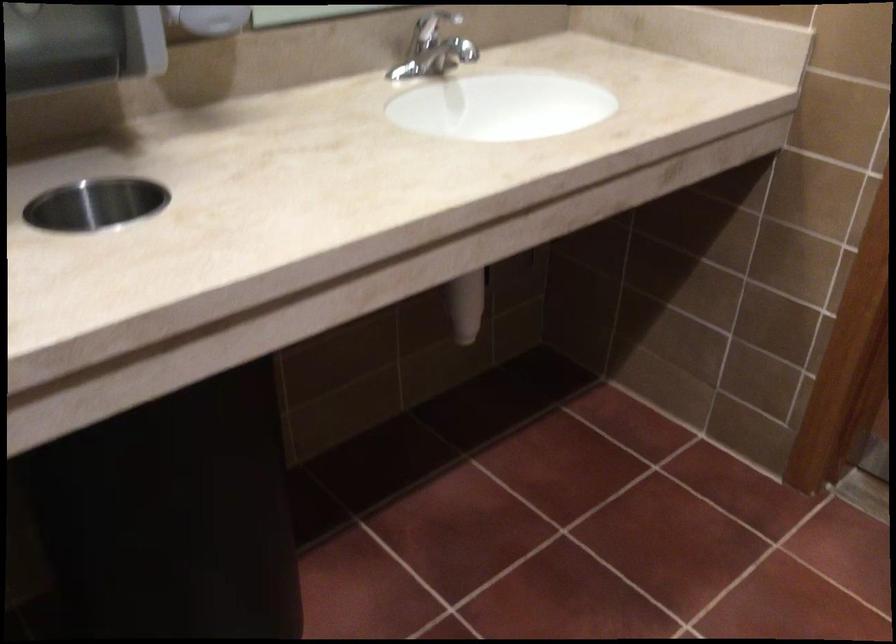
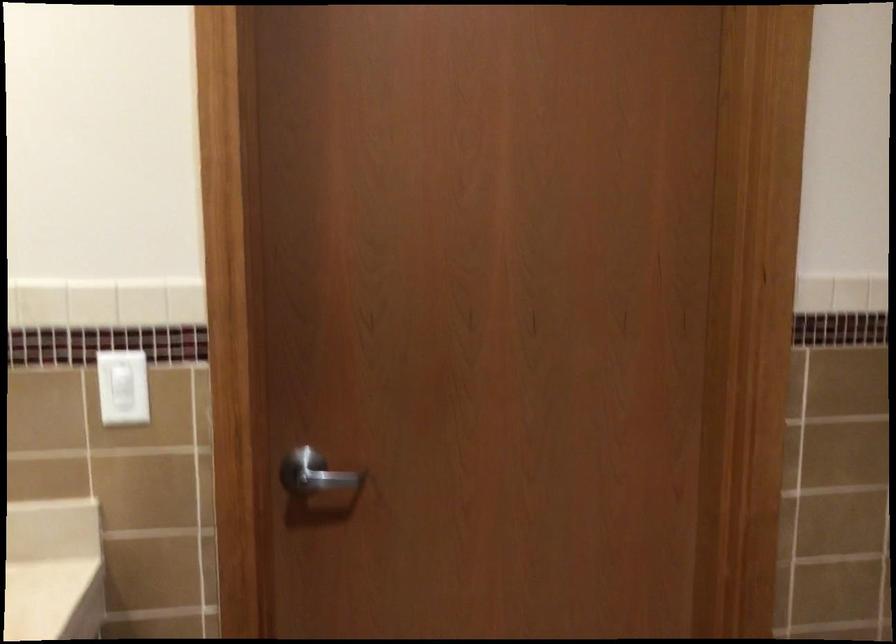
Question: The camera is either moving clockwise (left) or counter-clockwise (right) around the object. The first image is from the beginning of the video and the second image is from the end. Is the camera moving left or right when shooting the video?

Choices:
 (A) Left
 (B) Right

Answer: (A)